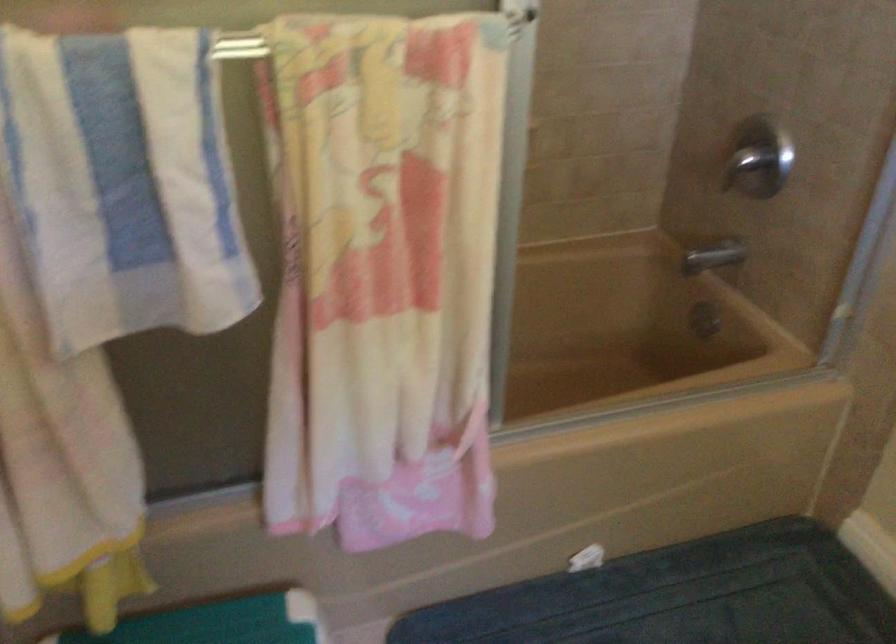
How did the camera likely rotate?

The camera's rotation is toward right-down.